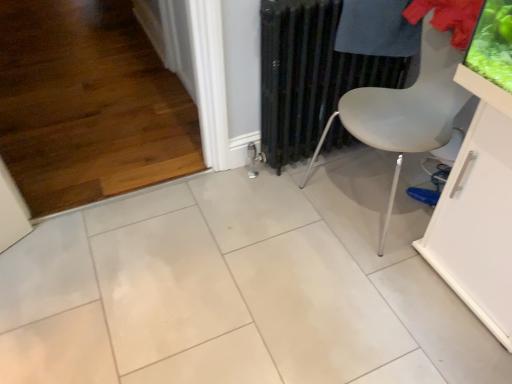
Image resolution: width=512 pixels, height=384 pixels. In order to click on vacant area that lies between white matte chair at center-right and black metal radiator at center in this screenshot , I will do `click(313, 200)`.